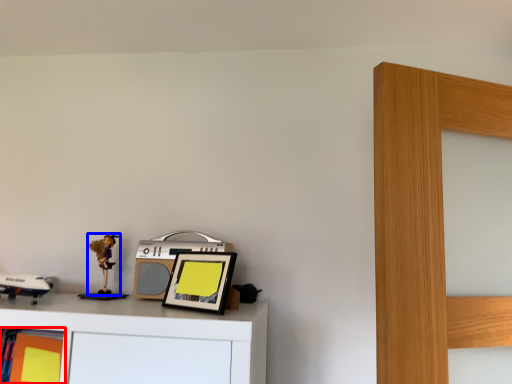
Question: Which of the following is the closest to the observer, shelf (highlighted by a red box) or toy (highlighted by a blue box)?

Choices:
 (A) shelf
 (B) toy

Answer: (A)